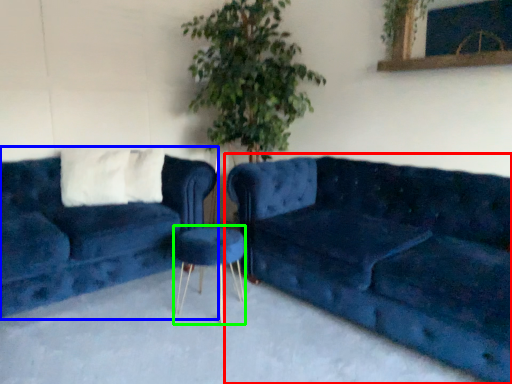
Question: Based on their relative distances, which object is farther from studio couch (highlighted by a red box)? Choose from studio couch (highlighted by a blue box) and bar stool (highlighted by a green box).

Choices:
 (A) studio couch
 (B) bar stool

Answer: (A)